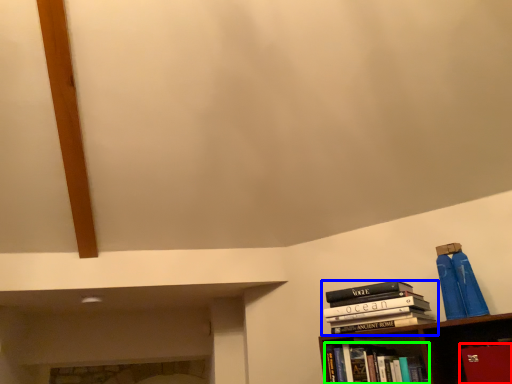
Question: Which object is positioned farthest from paperback book (highlighted by a red box)? Select from book (highlighted by a blue box) and book (highlighted by a green box).

Choices:
 (A) book
 (B) book

Answer: (B)